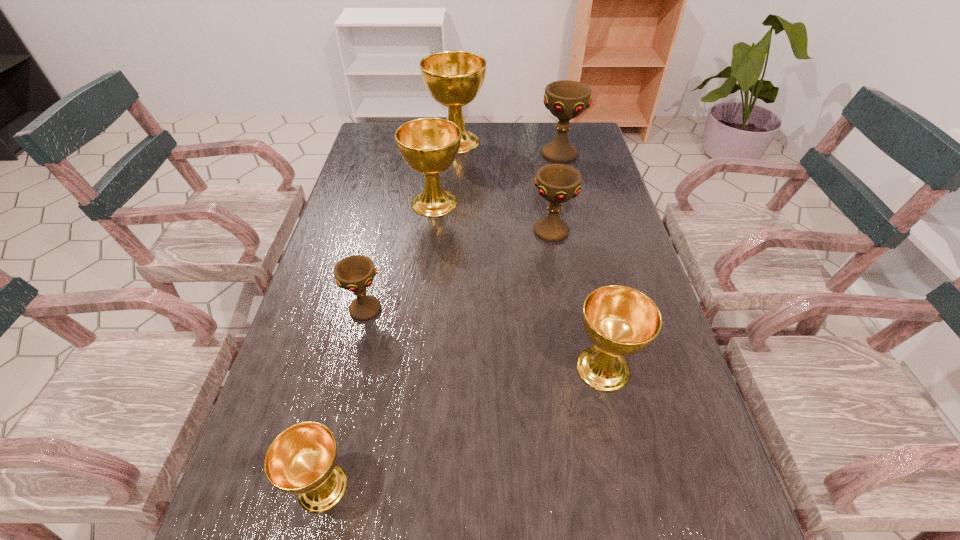
You are a GUI agent. You are given a task and a screenshot of the screen. Output one action in this format:
    pyautogui.click(x=<x>, y=<y>)
    Task: Click on the nearest chalice
    The width and height of the screenshot is (960, 540).
    Given the screenshot: What is the action you would take?
    pyautogui.click(x=301, y=460)

Locate an element on the screen. The height and width of the screenshot is (540, 960). vacant region located on the right of the tallest object is located at coordinates (576, 141).

Find the location of a particular element. free space located on the back of the biggest red chalice is located at coordinates (554, 132).

Find the location of a particular element. This screenshot has height=540, width=960. vacant space located 0.360m on the back of the third nearest gold chalice is located at coordinates (443, 130).

At what (x,y) coordinates should I click in order to perform the action: click on free space located 0.240m on the back of the second nearest red chalice. Please return your answer as a coordinate pair (x, y). Looking at the image, I should click on 541,172.

Locate an element on the screen. This screenshot has height=540, width=960. vacant area situated on the back of the second nearest gold chalice is located at coordinates (572, 232).

You are a GUI agent. You are given a task and a screenshot of the screen. Output one action in this format:
    pyautogui.click(x=<x>, y=<y>)
    Task: Click on the free spot located 0.160m on the right of the fifth farthest object
    The height and width of the screenshot is (540, 960).
    Given the screenshot: What is the action you would take?
    pyautogui.click(x=453, y=309)

Locate an element on the screen. vacant space located 0.310m on the right of the smallest gold chalice is located at coordinates (535, 487).

I want to click on object that is positioned at the far right corner, so click(566, 99).

Where is `vacant space at the far edge`? The width and height of the screenshot is (960, 540). vacant space at the far edge is located at coordinates (529, 146).